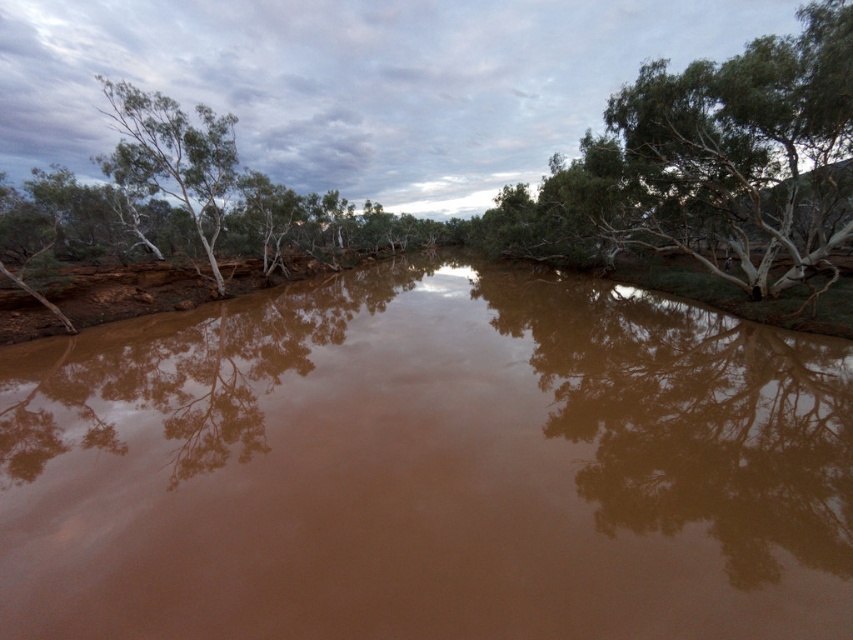
You are standing on the riverbank and want to compare the sizes of the brown muddy water at center and the green leafy tree at left. Which one appears larger in the image?

The green leafy tree at left appears larger than the brown muddy water at center in the image.

You are standing at the riverbank and want to know which tree is closer to you. The two trees you see are the green leafy tree at center and the green leafy tree at left. Based on their sizes, can you determine which one is nearer?

The green leafy tree at center has a smaller size compared to the green leafy tree at left. Since objects closer to the viewer appear larger, the green leafy tree at left is actually closer to you.

You are standing at the riverbank and want to know if the brown muddy water at center is taller than the green leafy tree at left. Based on the scene, can you tell me which one is taller?

The brown muddy water at center is shorter than the green leafy tree at left, so the tree is taller.